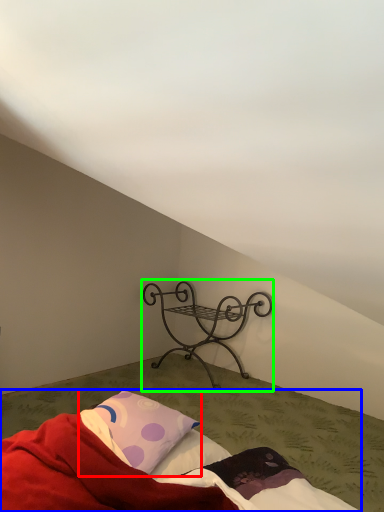
Question: Estimate the real-world distances between objects in this image. Which object is closer to pillow (highlighted by a red box), bed (highlighted by a blue box) or furniture (highlighted by a green box)?

Choices:
 (A) bed
 (B) furniture

Answer: (A)